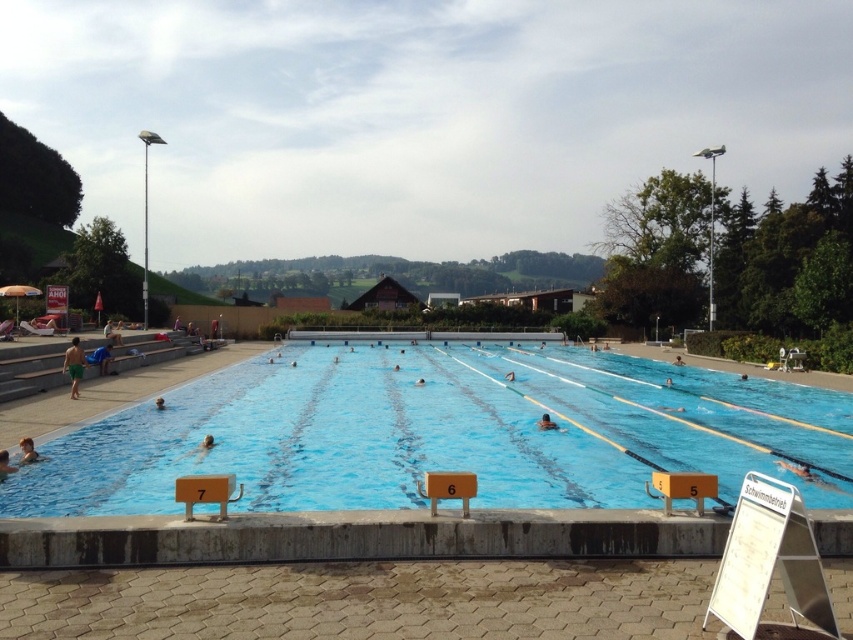
Which is more to the left, light brown hair at center or light blue skin at center?

light brown hair at center

Who is shorter, light brown hair at center or light blue skin at center?

With less height is light blue skin at center.

Locate an element on the screen. This screenshot has height=640, width=853. light brown hair at center is located at coordinates (28, 451).

Is brown hair at upper center taller than white matte person at center?

No, brown hair at upper center is not taller than white matte person at center.

In the scene shown: How much distance is there between brown hair at upper center and white matte person at center?

The distance of brown hair at upper center from white matte person at center is 4.44 meters.

What do you see at coordinates (206, 442) in the screenshot?
I see `brown hair at upper center` at bounding box center [206, 442].

You are a GUI agent. You are given a task and a screenshot of the screen. Output one action in this format:
    pyautogui.click(x=<x>, y=<y>)
    Task: Click on the brown hair at upper center
    
    Given the screenshot: What is the action you would take?
    [x=206, y=442]

Is blue smooth water at center below white matte swimmer at center?

Actually, blue smooth water at center is above white matte swimmer at center.

Which is below, blue smooth water at center or white matte swimmer at center?

Positioned lower is white matte swimmer at center.

You are a GUI agent. You are given a task and a screenshot of the screen. Output one action in this format:
    pyautogui.click(x=<x>, y=<y>)
    Task: Click on the blue smooth water at center
    This screenshot has width=853, height=640.
    Given the screenshot: What is the action you would take?
    pyautogui.click(x=440, y=433)